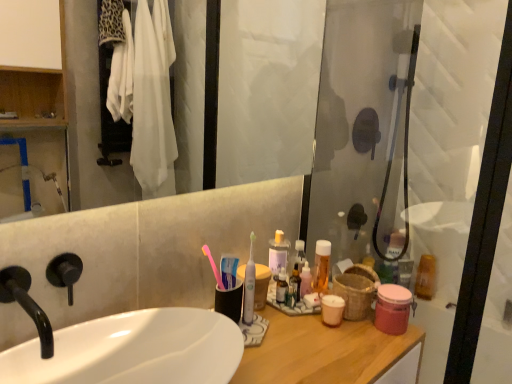
Question: Does translucent plastic mouthwash at upper right, the 2th mouthwash from the right, lie behind pink plastic toothbrush at center, the 1th toothbrush from the left?

Choices:
 (A) yes
 (B) no

Answer: (A)

Question: Is translucent plastic mouthwash at upper right, the 2th mouthwash from the right, not near pink plastic toothbrush at center, the 1th toothbrush from the left?

Choices:
 (A) yes
 (B) no

Answer: (B)

Question: Is translucent plastic mouthwash at upper right, which is the first mouthwash in back-to-front order, turned away from pink plastic toothbrush at center, the 1th toothbrush from the left?

Choices:
 (A) no
 (B) yes

Answer: (A)

Question: Can pink plastic toothbrush at center, the 1th toothbrush from the left, be found inside translucent plastic mouthwash at upper right, arranged as the third mouthwash when viewed from the left?

Choices:
 (A) no
 (B) yes

Answer: (A)

Question: Can you confirm if translucent plastic mouthwash at upper right, which appears as the 4th mouthwash when viewed from the front, is positioned to the left of pink plastic toothbrush at center, marked as the 2th toothbrush in a right-to-left arrangement?

Choices:
 (A) yes
 (B) no

Answer: (B)

Question: Is translucent plastic mouthwash at upper right, the 2th mouthwash from the right, touching pink plastic toothbrush at center, marked as the 2th toothbrush in a right-to-left arrangement?

Choices:
 (A) no
 (B) yes

Answer: (A)

Question: From a real-world perspective, is translucent plastic mouthwash at upper right, the 2th mouthwash from the right, positioned over translucent plastic mouthwash at center, placed as the 2th mouthwash when sorted from front to back, based on gravity?

Choices:
 (A) no
 (B) yes

Answer: (A)

Question: Is translucent plastic mouthwash at upper right, arranged as the third mouthwash when viewed from the left, closer to the viewer compared to translucent plastic mouthwash at center, placed as the 2th mouthwash when sorted from front to back?

Choices:
 (A) yes
 (B) no

Answer: (B)

Question: Considering the relative positions of translucent plastic mouthwash at upper right, which is the first mouthwash in back-to-front order, and translucent plastic mouthwash at center, acting as the 1th mouthwash starting from the left, in the image provided, is translucent plastic mouthwash at upper right, which is the first mouthwash in back-to-front order, to the left of translucent plastic mouthwash at center, acting as the 1th mouthwash starting from the left, from the viewer's perspective?

Choices:
 (A) yes
 (B) no

Answer: (B)

Question: Is translucent plastic mouthwash at upper right, arranged as the third mouthwash when viewed from the left, positioned beyond the bounds of translucent plastic mouthwash at center, the 4th mouthwash viewed from the right?

Choices:
 (A) yes
 (B) no

Answer: (A)

Question: Does translucent plastic mouthwash at upper right, which appears as the 4th mouthwash when viewed from the front, have a lesser height compared to translucent plastic mouthwash at center, placed as the 2th mouthwash when sorted from front to back?

Choices:
 (A) yes
 (B) no

Answer: (B)

Question: Can you confirm if translucent plastic mouthwash at upper right, which is the first mouthwash in back-to-front order, is positioned to the right of translucent plastic mouthwash at center, placed as the 2th mouthwash when sorted from front to back?

Choices:
 (A) yes
 (B) no

Answer: (A)

Question: From a real-world perspective, is pink plastic toothbrush at center, the 1th toothbrush from the left, located higher than white glossy sink at center?

Choices:
 (A) yes
 (B) no

Answer: (A)